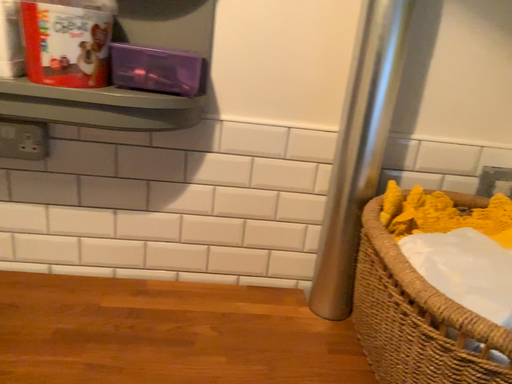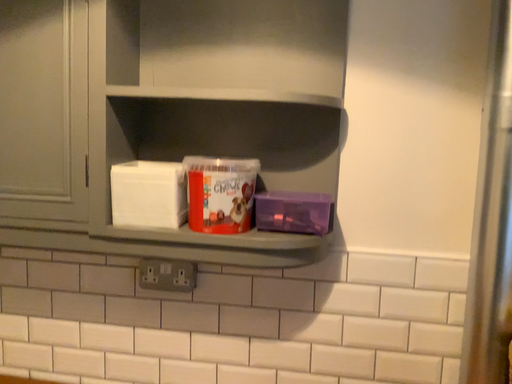
Question: How did the camera likely rotate when shooting the video?

Choices:
 (A) rotated right
 (B) rotated left

Answer: (B)